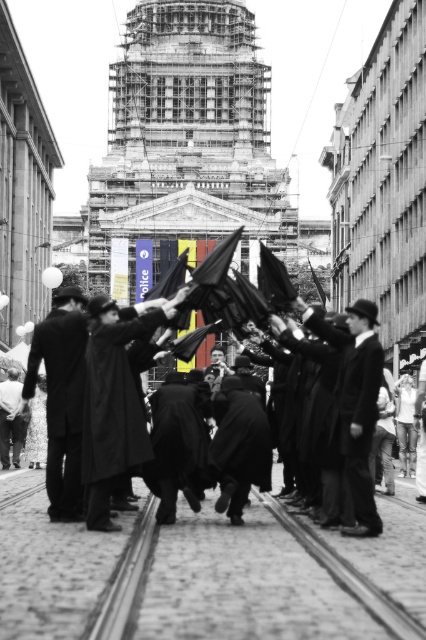
Question: Is dark wool coat at center positioned at the back of dark wool coat at lower left?

Choices:
 (A) no
 (B) yes

Answer: (A)

Question: Which object appears closest to the camera in this image?

Choices:
 (A) dark wool coat at center
 (B) dark wool coat at lower left
 (C) dark woolen robe at center
 (D) smooth black coat at center

Answer: (D)

Question: Can you confirm if matte black coat at center is thinner than smooth black coat at center?

Choices:
 (A) yes
 (B) no

Answer: (B)

Question: Which point is closer to the camera taking this photo?

Choices:
 (A) 368,452
 (B) 14,458
 (C) 106,456
 (D) 155,496

Answer: (C)

Question: Which point is closer to the camera?

Choices:
 (A) dark wool coat at lower left
 (B) smooth black coat at center
 (C) black woolen robe at center

Answer: (B)

Question: Does black woolen robe at center have a larger size compared to dark woolen robe at center?

Choices:
 (A) no
 (B) yes

Answer: (B)